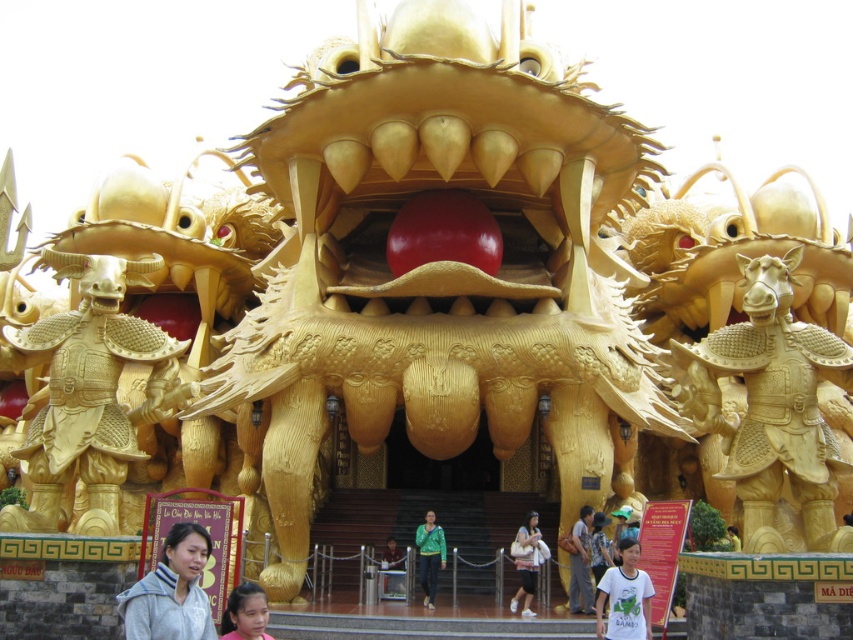
Question: Is light gray fleece jacket at lower left further to camera compared to white cotton t-shirt at center?

Choices:
 (A) yes
 (B) no

Answer: (B)

Question: Does smooth skin face at center appear on the left side of matte gold dress at center?

Choices:
 (A) yes
 (B) no

Answer: (A)

Question: Is smooth skin face at center below matte gold dress at center?

Choices:
 (A) no
 (B) yes

Answer: (A)

Question: Which point is farther from the camera taking this photo?

Choices:
 (A) [x=641, y=634]
 (B) [x=242, y=582]
 (C) [x=433, y=580]
 (D) [x=181, y=547]

Answer: (C)

Question: Which point is closer to the camera taking this photo?

Choices:
 (A) (520, 19)
 (B) (619, 605)
 (C) (254, 609)

Answer: (C)

Question: Estimate the real-world distances between objects in this image. Which object is farther from the gold textured armor at right?

Choices:
 (A) smooth skin face at center
 (B) green matte jacket at center
 (C) matte gold dress at center
 (D) light gray fleece jacket at lower left

Answer: (D)